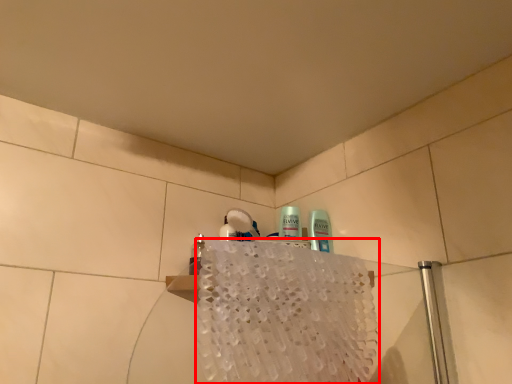
Question: Observing the image, what is the correct spatial positioning of bath towel (annotated by the red box) in reference to mouthwash?

Choices:
 (A) left
 (B) right

Answer: (B)